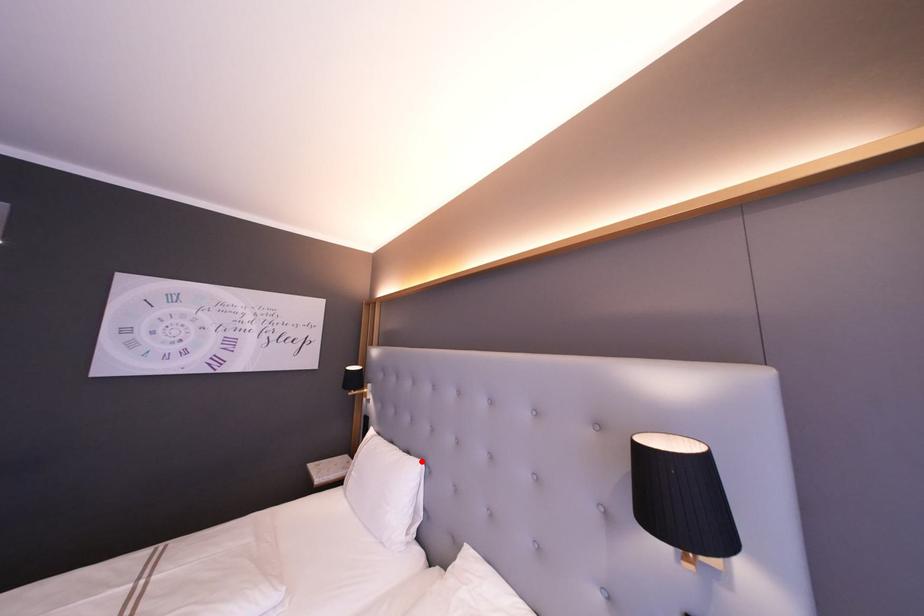
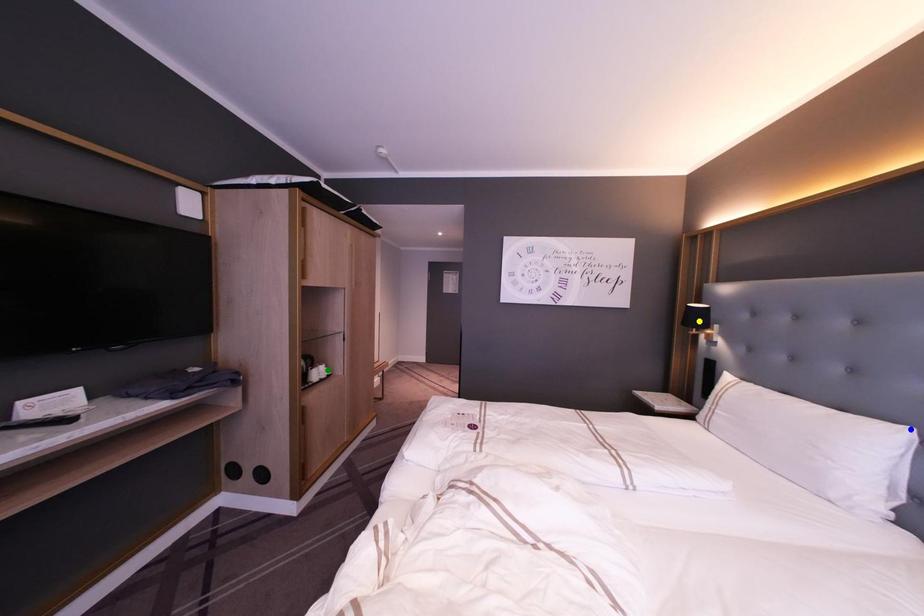
Question: I am providing you with two images of the same scene from different viewpoints. A red point is marked on the first image. You are given multiple points on the second image. Which point in image 2 is actually the same real-world point as the red point in image 1?

Choices:
 (A) blue point
 (B) yellow point
 (C) green point

Answer: (A)